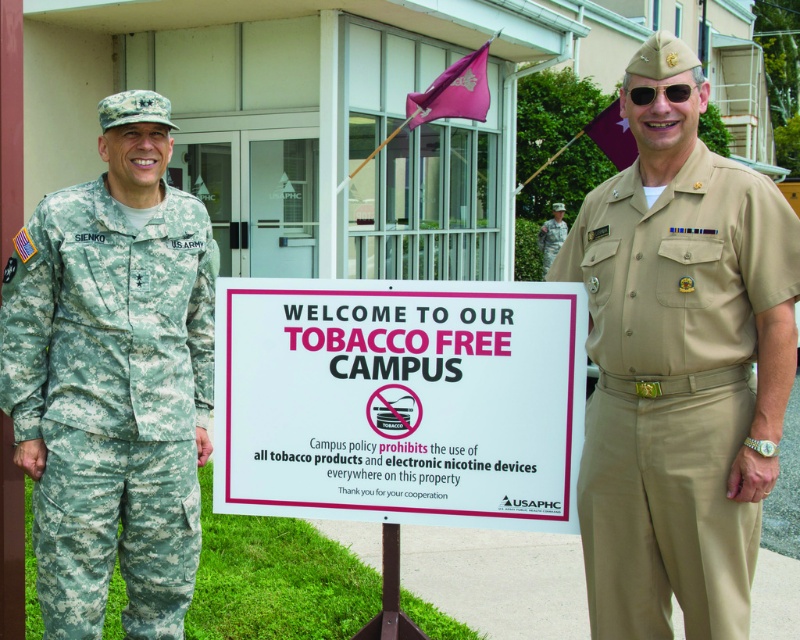
Question: Does white paper sign at center have a larger size compared to camouflage fabric uniform at left?

Choices:
 (A) yes
 (B) no

Answer: (B)

Question: Which of these objects is positioned farthest from the camouflage fabric uniform at center?

Choices:
 (A) tan/khaki fabric uniform at right
 (B) white paper sign at center

Answer: (A)

Question: Can you confirm if white paper sign at center is thinner than tan/khaki fabric uniform at right?

Choices:
 (A) no
 (B) yes

Answer: (A)

Question: Which object appears closest to the camera in this image?

Choices:
 (A) white paper sign at center
 (B) camouflage fabric uniform at center
 (C) tan/khaki fabric uniform at right
 (D) camouflage fabric uniform at left

Answer: (C)

Question: Is camouflage fabric uniform at left positioned before camouflage fabric uniform at center?

Choices:
 (A) no
 (B) yes

Answer: (B)

Question: Which of the following is the farthest from the observer?

Choices:
 (A) (556, 225)
 (B) (540, 480)

Answer: (A)